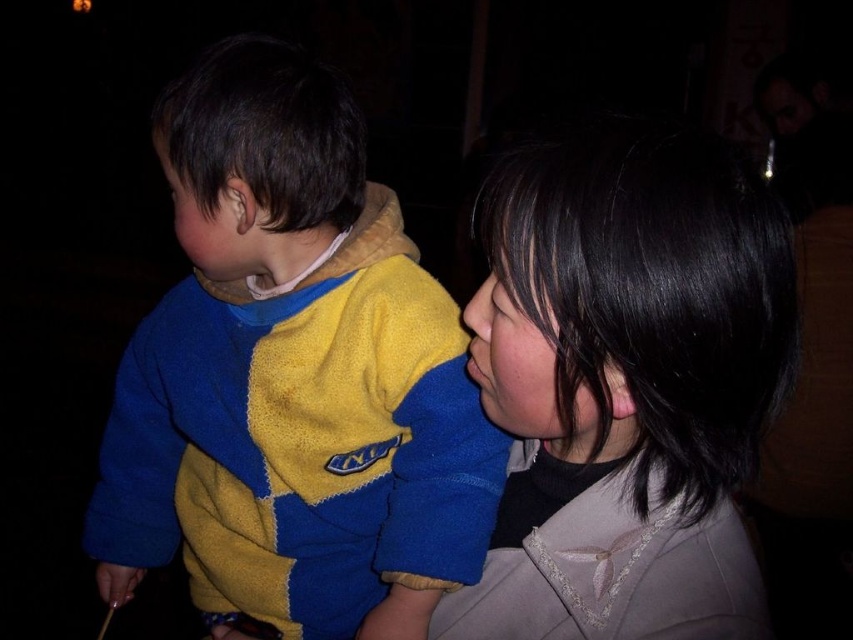
Question: Which object is farther from the camera taking this photo?

Choices:
 (A) smooth black hair at upper right
 (B) yellow fleece sweater at left

Answer: (B)

Question: Can you confirm if yellow fleece sweater at left is positioned to the left of smooth black hair at upper right?

Choices:
 (A) yes
 (B) no

Answer: (A)

Question: Which point is closer to the camera?

Choices:
 (A) (457, 362)
 (B) (685, 157)

Answer: (B)

Question: Is yellow fleece sweater at left thinner than smooth black hair at upper right?

Choices:
 (A) no
 (B) yes

Answer: (A)

Question: Can you confirm if yellow fleece sweater at left is wider than smooth black hair at upper right?

Choices:
 (A) no
 (B) yes

Answer: (B)

Question: Which of the following is the farthest from the observer?

Choices:
 (A) (97, 541)
 (B) (512, 385)

Answer: (A)